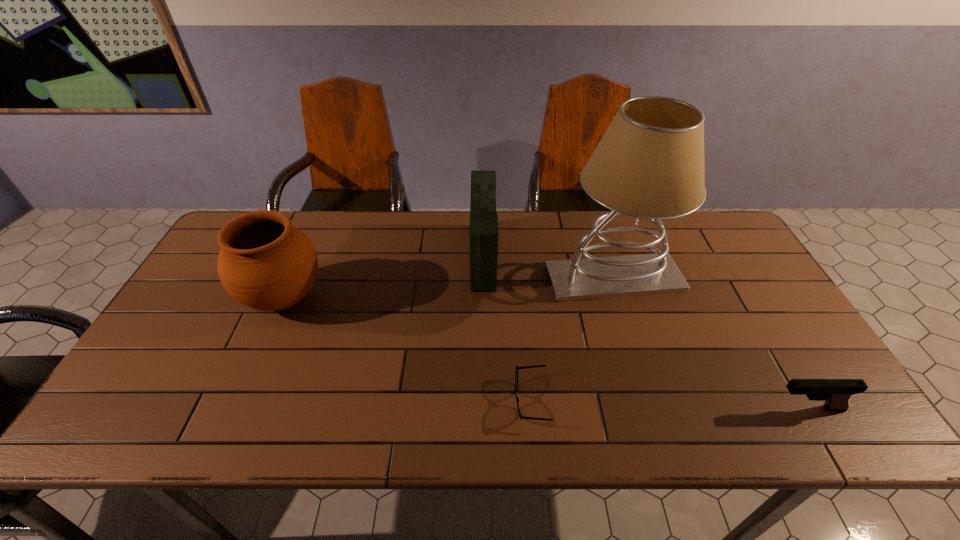
Image resolution: width=960 pixels, height=540 pixels. I want to click on vacant space located on the front-facing side of the first-aid kit, so click(x=414, y=256).

Image resolution: width=960 pixels, height=540 pixels. Find the location of `free space located on the front-facing side of the first-aid kit`. free space located on the front-facing side of the first-aid kit is located at coordinates [x=362, y=256].

Identify the location of free spot located on the front-facing side of the first-aid kit. Image resolution: width=960 pixels, height=540 pixels. (455, 256).

Locate an element on the screen. vacant region located 0.290m on the front-facing side of the pistol is located at coordinates (642, 409).

This screenshot has height=540, width=960. Find the location of `free point located on the front-facing side of the pistol`. free point located on the front-facing side of the pistol is located at coordinates (633, 409).

You are a GUI agent. You are given a task and a screenshot of the screen. Output one action in this format:
    pyautogui.click(x=<x>, y=<y>)
    Task: Click on the free space located 0.230m on the front-facing side of the pistol
    This screenshot has height=540, width=960.
    Given the screenshot: What is the action you would take?
    pyautogui.click(x=668, y=409)

Where is `vacant space situated 0.110m on the front-facing side of the third object from left to right`? vacant space situated 0.110m on the front-facing side of the third object from left to right is located at coordinates (466, 401).

Where is `vacant space located on the front-facing side of the third object from left to right`? This screenshot has height=540, width=960. vacant space located on the front-facing side of the third object from left to right is located at coordinates (418, 401).

The image size is (960, 540). Identify the location of vacant region located on the front-facing side of the third object from left to right. (388, 401).

Locate an element on the screen. table lamp that is at the far edge is located at coordinates (649, 164).